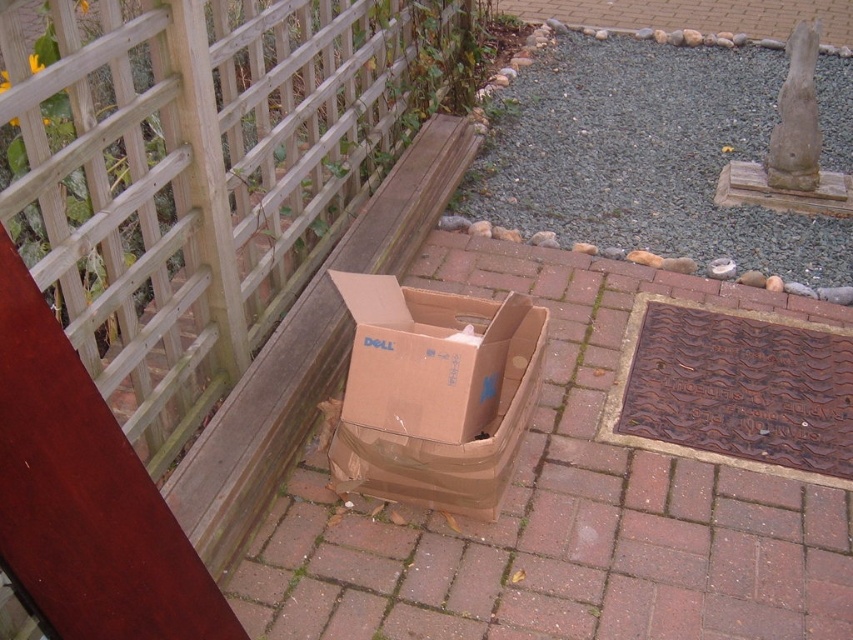
Question: Which of the following is the farthest from the observer?

Choices:
 (A) wooden lattice at left
 (B) brown cardboard box at center

Answer: (B)

Question: Does wooden lattice at left lie behind brown cardboard box at center?

Choices:
 (A) no
 (B) yes

Answer: (A)

Question: In this image, where is wooden lattice at left located relative to brown cardboard box at center?

Choices:
 (A) below
 (B) above

Answer: (B)

Question: Can you confirm if wooden lattice at left is positioned below brown cardboard box at center?

Choices:
 (A) no
 (B) yes

Answer: (A)

Question: Among these points, which one is nearest to the camera?

Choices:
 (A) (143, 340)
 (B) (529, 378)

Answer: (A)